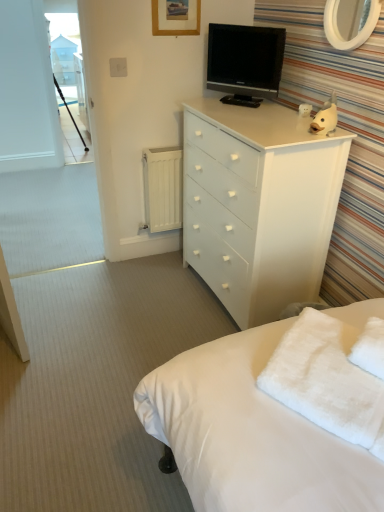
You are a GUI agent. You are given a task and a screenshot of the screen. Output one action in this format:
    pyautogui.click(x=<x>, y=<y>)
    Task: Click on the free point to the left of white matte fish at upper right
    Image resolution: width=384 pixels, height=512 pixels.
    Given the screenshot: What is the action you would take?
    pyautogui.click(x=283, y=132)